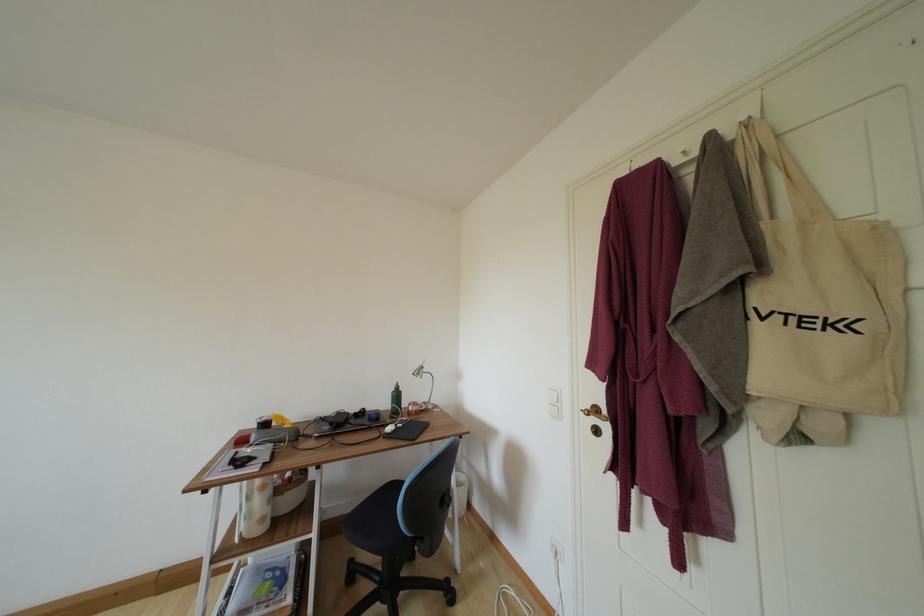
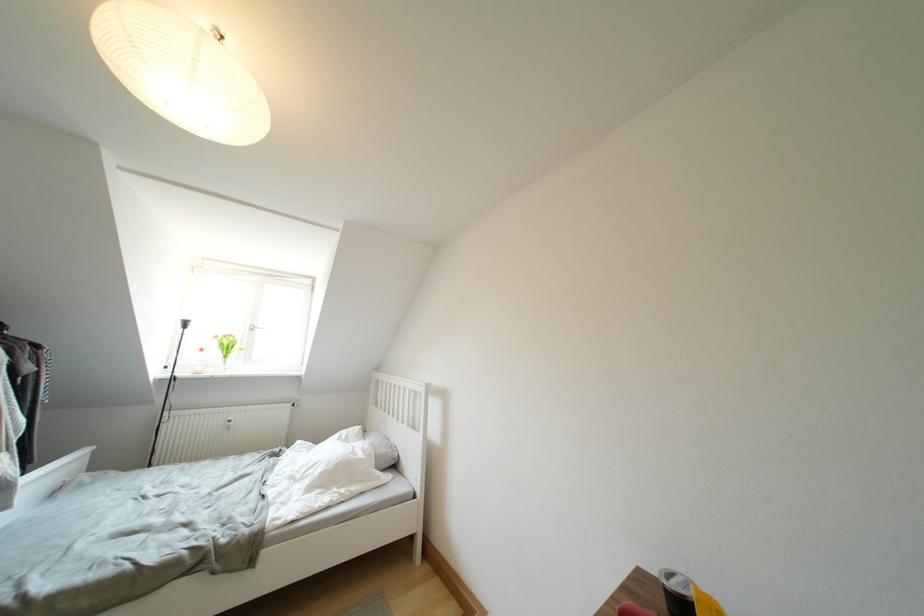
Question: How did the camera likely rotate?

Choices:
 (A) Left
 (B) Right
 (C) Up
 (D) Down

Answer: (A)